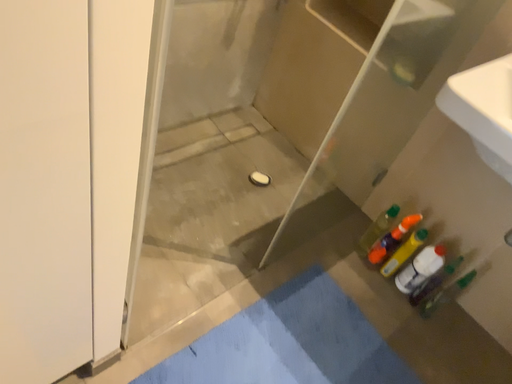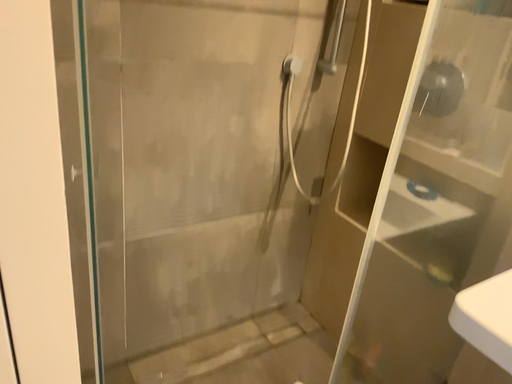
Question: Which way did the camera rotate in the video?

Choices:
 (A) rotated downward
 (B) rotated upward

Answer: (B)